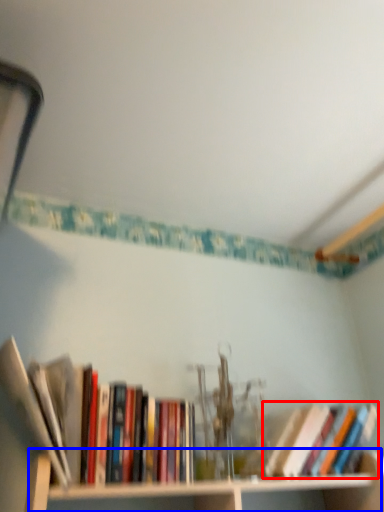
Question: Which object is further to the camera taking this photo, book (highlighted by a red box) or cabinet (highlighted by a blue box)?

Choices:
 (A) book
 (B) cabinet

Answer: (A)